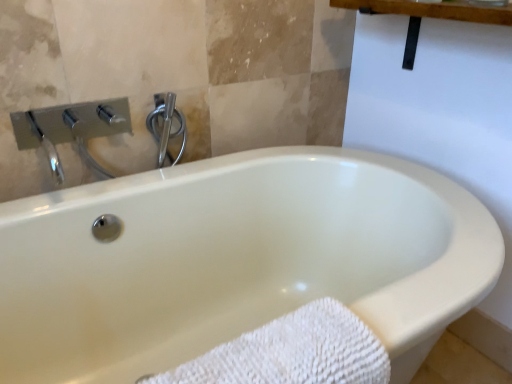
Question: From a real-world perspective, is chrome/metallic shower handle at upper center physically below white textured towel at lower left?

Choices:
 (A) no
 (B) yes

Answer: (A)

Question: Is chrome/metallic shower handle at upper center positioned behind white textured towel at lower left?

Choices:
 (A) no
 (B) yes

Answer: (B)

Question: Does chrome/metallic shower handle at upper center contain white textured towel at lower left?

Choices:
 (A) no
 (B) yes

Answer: (A)

Question: Can you confirm if chrome/metallic shower handle at upper center is smaller than white textured towel at lower left?

Choices:
 (A) no
 (B) yes

Answer: (B)

Question: Does chrome/metallic shower handle at upper center have a lesser width compared to white textured towel at lower left?

Choices:
 (A) no
 (B) yes

Answer: (B)

Question: Is chrome/metallic shower handle at upper center at the left side of white textured towel at lower left?

Choices:
 (A) yes
 (B) no

Answer: (A)

Question: Is white textured towel at lower left oriented towards chrome/metallic shower handle at upper center?

Choices:
 (A) yes
 (B) no

Answer: (B)

Question: From a real-world perspective, does white textured towel at lower left stand above chrome/metallic shower handle at upper center?

Choices:
 (A) no
 (B) yes

Answer: (A)

Question: Can you confirm if white textured towel at lower left is positioned to the right of chrome/metallic shower handle at upper center?

Choices:
 (A) yes
 (B) no

Answer: (A)

Question: Does white textured towel at lower left appear on the left side of chrome/metallic shower handle at upper center?

Choices:
 (A) no
 (B) yes

Answer: (A)

Question: From a real-world perspective, is white textured towel at lower left positioned under chrome/metallic shower handle at upper center based on gravity?

Choices:
 (A) yes
 (B) no

Answer: (A)

Question: Is white textured towel at lower left further to camera compared to chrome/metallic shower handle at upper center?

Choices:
 (A) no
 (B) yes

Answer: (A)

Question: Considering the positions of chrome/metallic shower handle at upper center and white textured towel at lower left in the image, is chrome/metallic shower handle at upper center wider or thinner than white textured towel at lower left?

Choices:
 (A) wide
 (B) thin

Answer: (B)